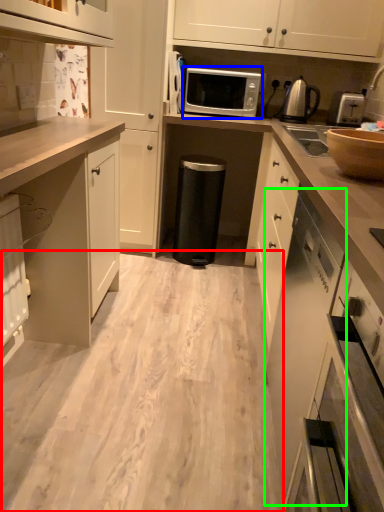
Question: Which object is positioned closest to plain (highlighted by a red box)? Select from microwave oven (highlighted by a blue box) and cabinetry (highlighted by a green box).

Choices:
 (A) microwave oven
 (B) cabinetry

Answer: (B)